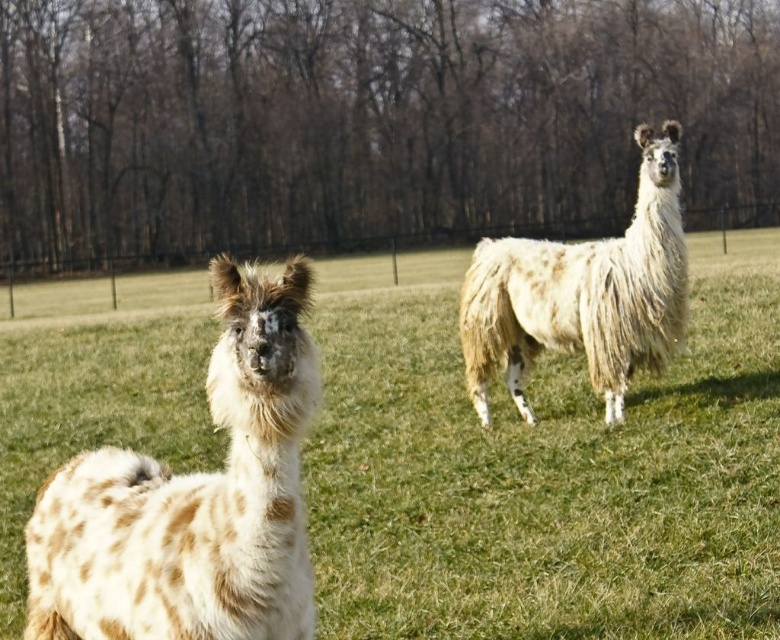
Question: Among these objects, which one is nearest to the camera?

Choices:
 (A) speckled wool alpaca at left
 (B) spotted wool llama at center
 (C) fuzzy white alpaca at right

Answer: (A)

Question: Which object appears closest to the camera in this image?

Choices:
 (A) spotted wool llama at center
 (B) fuzzy white alpaca at right
 (C) speckled wool alpaca at left

Answer: (C)

Question: Based on their relative distances, which object is farther from the speckled wool alpaca at left?

Choices:
 (A) fuzzy white alpaca at right
 (B) spotted wool llama at center

Answer: (B)

Question: Is spotted wool llama at center thinner than fuzzy white alpaca at right?

Choices:
 (A) yes
 (B) no

Answer: (B)

Question: Does spotted wool llama at center appear under fuzzy white alpaca at right?

Choices:
 (A) no
 (B) yes

Answer: (A)

Question: Considering the relative positions of spotted wool llama at center and speckled wool alpaca at left in the image provided, where is spotted wool llama at center located with respect to speckled wool alpaca at left?

Choices:
 (A) right
 (B) left

Answer: (A)